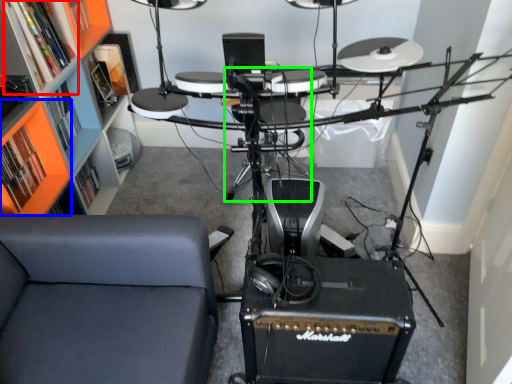
Question: Considering the real-world distances, which object is farthest from shelf (highlighted by a red box)? shelf (highlighted by a blue box) or armchair (highlighted by a green box)?

Choices:
 (A) shelf
 (B) armchair

Answer: (B)